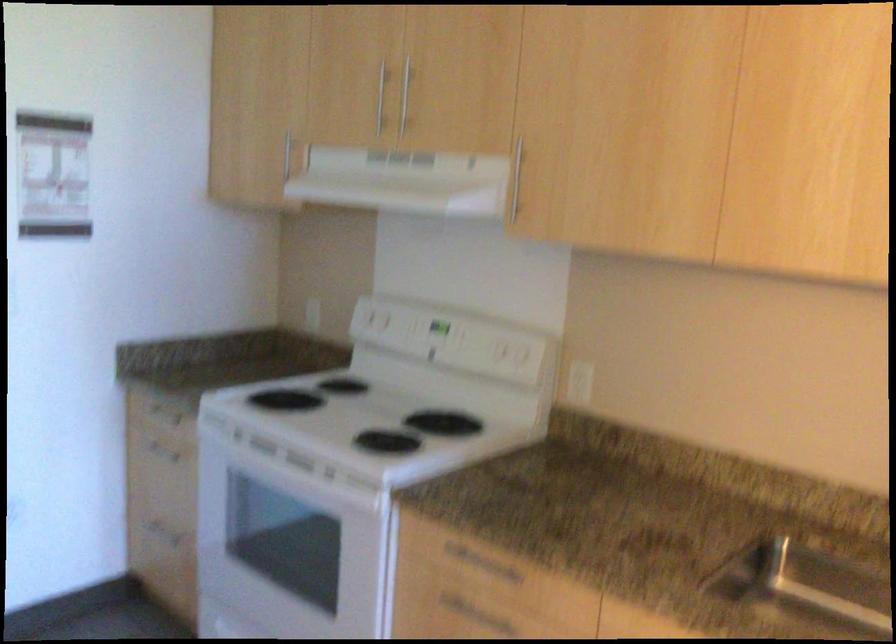
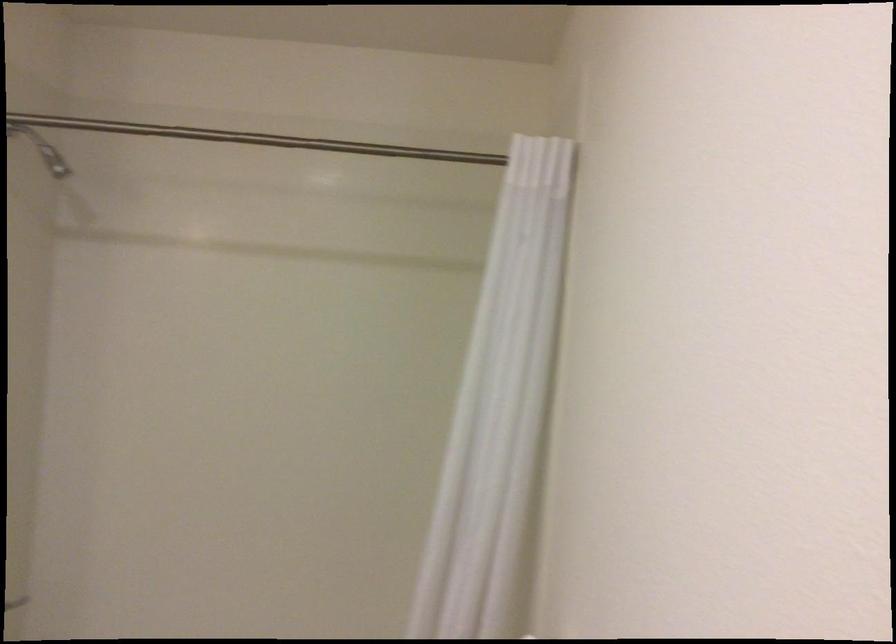
Question: The camera is either moving clockwise (left) or counter-clockwise (right) around the object. The first image is from the beginning of the video and the second image is from the end. Is the camera moving left or right when shooting the video?

Choices:
 (A) Left
 (B) Right

Answer: (B)